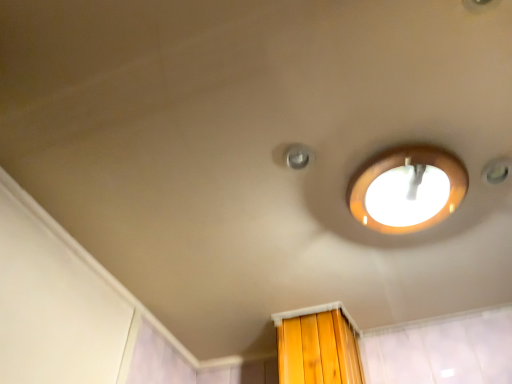
Question: Should I look upward or downward to see matte white lamp at upper center?

Choices:
 (A) up
 (B) down

Answer: (B)